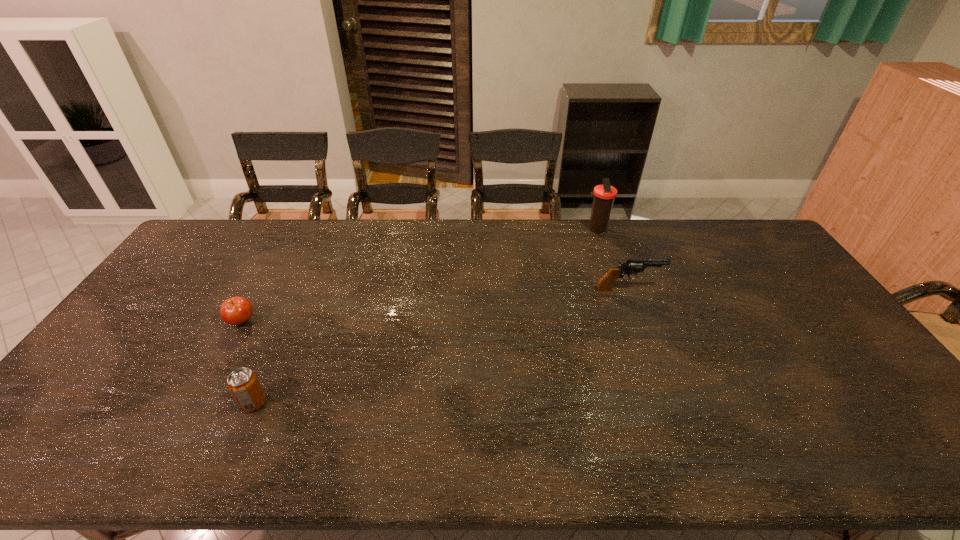
Locate an element on the screen. free space that satisfies the following two spatial constraints: 1. on the back side of the thermos bottle; 2. on the right side of the nearest object is located at coordinates (331, 230).

Locate an element on the screen. vacant region that satisfies the following two spatial constraints: 1. on the back side of the tallest object; 2. on the left side of the nearest object is located at coordinates (331, 230).

Find the location of a particular element. Image resolution: width=960 pixels, height=540 pixels. vacant area that satisfies the following two spatial constraints: 1. on the front side of the apple; 2. on the left side of the nearest object is located at coordinates (197, 403).